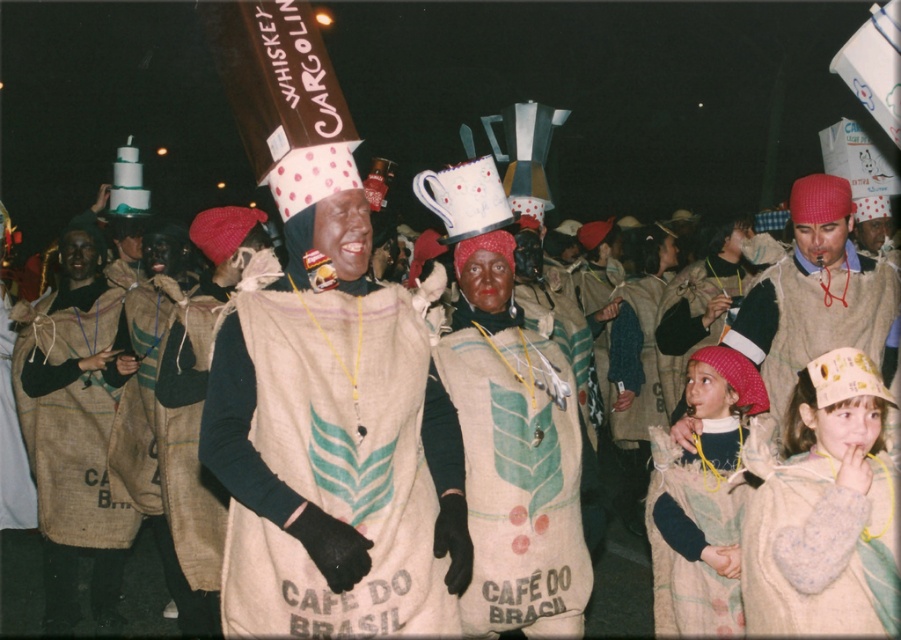
Can you confirm if fuzzy beige sweater at lower right is wider than fluffy beige sack at lower right?

Yes.

Measure the distance between fuzzy beige sweater at lower right and fluffy beige sack at lower right.

fuzzy beige sweater at lower right is 22.54 inches away from fluffy beige sack at lower right.

Locate an element on the screen. The image size is (901, 640). fuzzy beige sweater at lower right is located at coordinates (817, 548).

Who is taller, burlap sack at center or matte brown vest at center?

With more height is burlap sack at center.

Does burlap sack at center have a greater height compared to matte brown vest at center?

Yes, burlap sack at center is taller than matte brown vest at center.

I want to click on burlap sack at center, so click(517, 474).

The image size is (901, 640). I want to click on burlap sack at center, so click(x=517, y=474).

Consider the image. Which of these two, matte burlap sack at center or fuzzy beige sweater at lower right, stands shorter?

Standing shorter between the two is fuzzy beige sweater at lower right.

Does matte burlap sack at center have a greater width compared to fuzzy beige sweater at lower right?

Correct, the width of matte burlap sack at center exceeds that of fuzzy beige sweater at lower right.

Identify the location of matte burlap sack at center. The image size is (901, 640). (x=333, y=435).